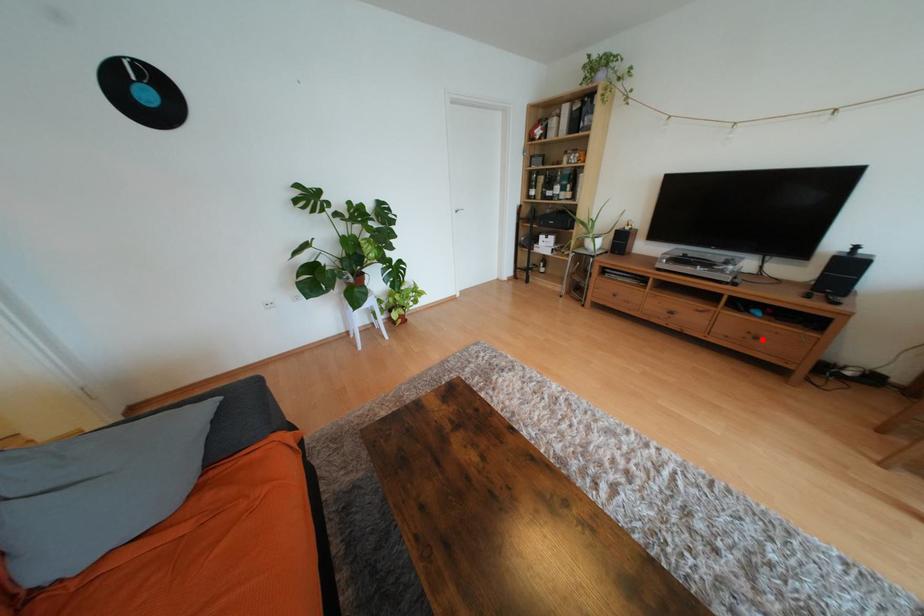
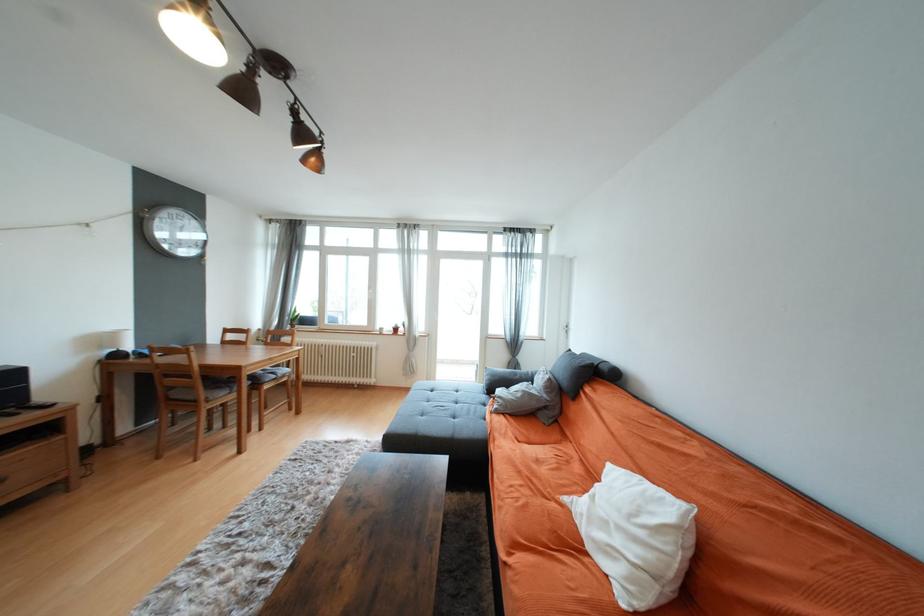
The point at the highlighted location is marked in the first image. Where is the corresponding point in the second image?

(7, 482)